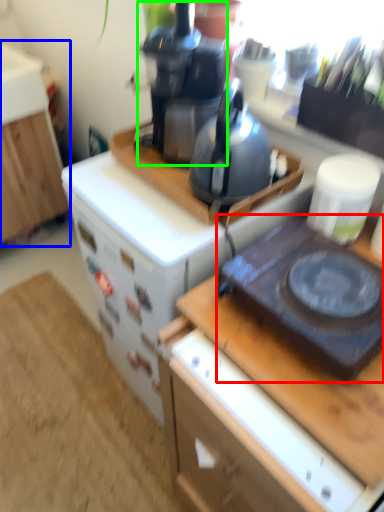
Question: Estimate the real-world distances between objects in this image. Which object is farther from gas stove (highlighted by a red box), cabinetry (highlighted by a blue box) or coffeepot (highlighted by a green box)?

Choices:
 (A) cabinetry
 (B) coffeepot

Answer: (A)